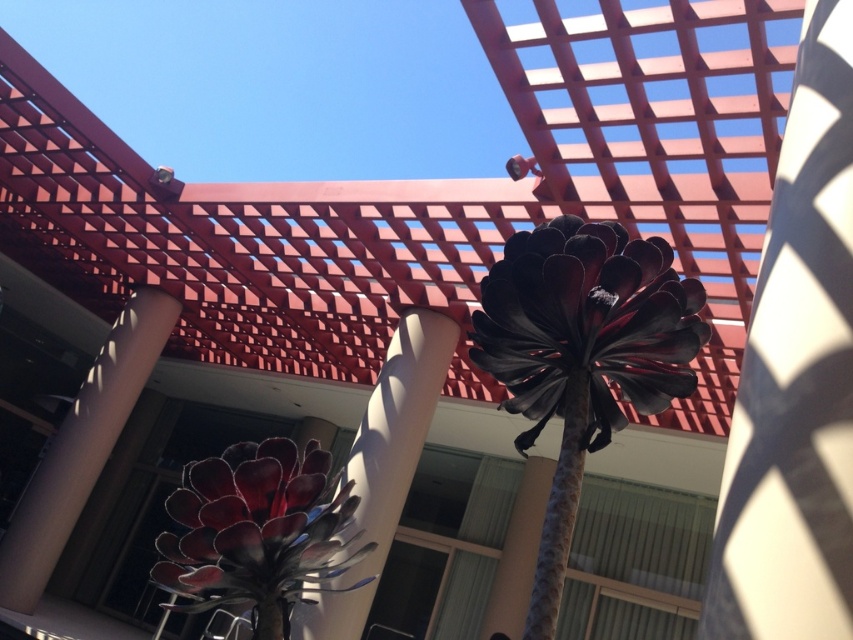
Question: Does metallic red flower at center appear under white glossy pillar at center?

Choices:
 (A) yes
 (B) no

Answer: (B)

Question: Considering the real-world distances, which object is farthest from the metallic red flower at center?

Choices:
 (A) white glossy pillar at center
 (B) metallic black flower at center

Answer: (A)

Question: Is metallic red flower at center in front of white glossy pillar at center?

Choices:
 (A) no
 (B) yes

Answer: (B)

Question: Does metallic black flower at center appear under metallic red flower at center?

Choices:
 (A) no
 (B) yes

Answer: (A)

Question: Which object is the closest to the metallic black flower at center?

Choices:
 (A) metallic red flower at center
 (B) white glossy pillar at center

Answer: (A)

Question: Which point appears farthest from the camera in this image?

Choices:
 (A) coord(264,611)
 (B) coord(593,348)

Answer: (B)